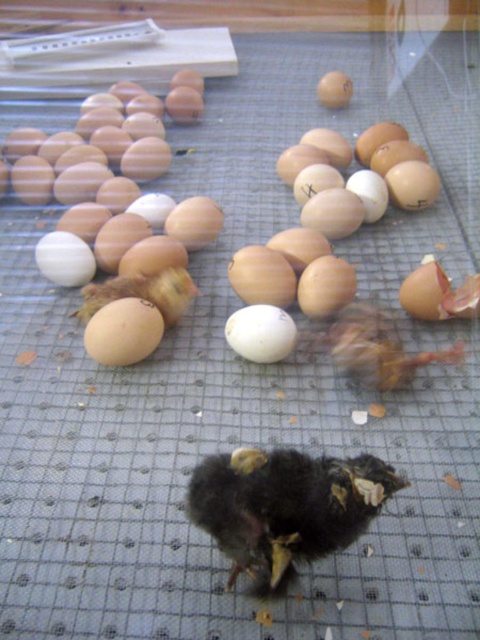
Is point (288, 568) positioned before point (146, 296)?

That is True.

Measure the distance from black downy chick at center to brown fuzzy chick at center.

black downy chick at center is 21.80 inches from brown fuzzy chick at center.

At what (x,y) coordinates should I click in order to perform the action: click on black downy chick at center. Please return your answer as a coordinate pair (x, y). The width and height of the screenshot is (480, 640). Looking at the image, I should click on (286, 506).

Where is `brown matte egg at upper left`? Image resolution: width=480 pixels, height=640 pixels. brown matte egg at upper left is located at coordinates (112, 180).

Between brown matte egg at upper left and white matte egg at center, which one is positioned lower?

white matte egg at center is lower down.

Where is `brown matte egg at upper left`? brown matte egg at upper left is located at coordinates (112, 180).

Is brown fuzzy chick at center bigger than white matte egg at center?

Yes, brown fuzzy chick at center is bigger than white matte egg at center.

Between brown fuzzy chick at center and white matte egg at center, which one appears on the right side from the viewer's perspective?

white matte egg at center

At what (x,y) coordinates should I click in order to perform the action: click on brown fuzzy chick at center. Please return your answer as a coordinate pair (x, y). The width and height of the screenshot is (480, 640). Looking at the image, I should click on (142, 292).